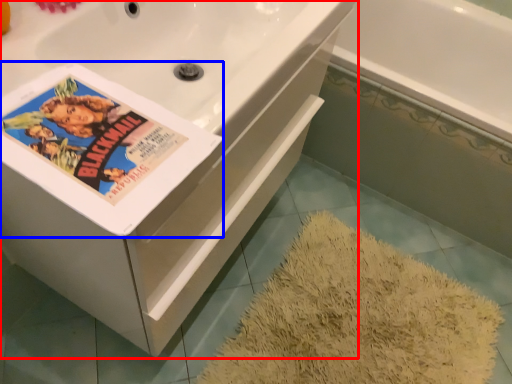
Question: Which object is further to the camera taking this photo, bathtub (highlighted by a red box) or paperback book (highlighted by a blue box)?

Choices:
 (A) bathtub
 (B) paperback book

Answer: (A)